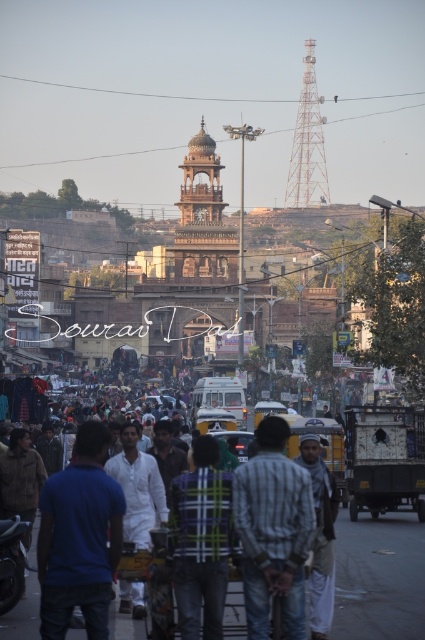
Question: Does brown stone clock tower at center appear over white cotton shirt at center?

Choices:
 (A) yes
 (B) no

Answer: (A)

Question: Which object is farther from the camera taking this photo?

Choices:
 (A) metallic bell tower at upper center
 (B) plaid shirt at center
 (C) striped cotton shirt at center
 (D) black matte motorcycle at lower left

Answer: (A)

Question: Which point is farther to the camera?

Choices:
 (A) (36, 467)
 (B) (45, 566)
 (C) (13, 561)

Answer: (A)

Question: Based on their relative distances, which object is farther from the metallic bell tower at upper center?

Choices:
 (A) striped fabric shirt at center
 (B) plaid shirt at center
 (C) blue cotton shirt at center
 (D) black matte motorcycle at lower left

Answer: (C)

Question: Is striped fabric shirt at center above black matte motorcycle at lower left?

Choices:
 (A) yes
 (B) no

Answer: (A)

Question: Is brown stone clock tower at center closer to the viewer compared to brown leather jacket at lower left?

Choices:
 (A) no
 (B) yes

Answer: (A)